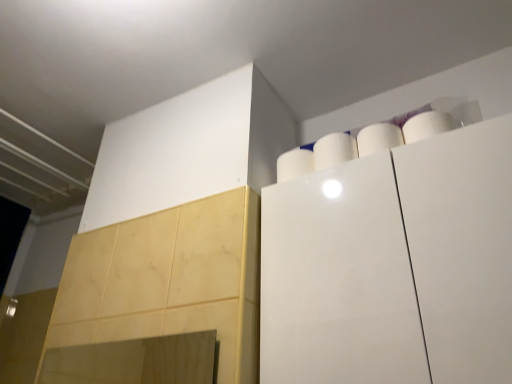
What do you see at coordinates (393, 266) in the screenshot?
I see `white glossy cabinet at upper right` at bounding box center [393, 266].

Identify the location of white glossy cabinet at upper right. Image resolution: width=512 pixels, height=384 pixels. (393, 266).

The image size is (512, 384). What are the coordinates of `white glossy cabinet at upper right` in the screenshot? It's located at (393, 266).